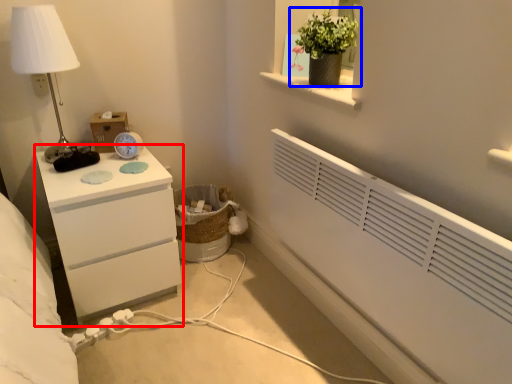
Question: Which point is further to the camera, chest of drawers (highlighted by a red box) or houseplant (highlighted by a blue box)?

Choices:
 (A) chest of drawers
 (B) houseplant

Answer: (A)